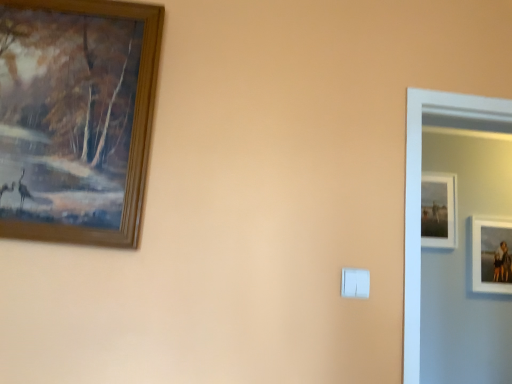
Question: Is wooden picture frame at upper left, acting as the 3th picture frame starting from the right, to the left of white matte picture frame at right, the second picture frame positioned from the back, from the viewer's perspective?

Choices:
 (A) no
 (B) yes

Answer: (B)

Question: Is wooden picture frame at upper left, the first picture frame positioned from the left, oriented away from white matte picture frame at right, the 2th picture frame when ordered from front to back?

Choices:
 (A) no
 (B) yes

Answer: (A)

Question: Does wooden picture frame at upper left, the first picture frame positioned from the left, have a lesser height compared to white matte picture frame at right, the 2th picture frame when ordered from front to back?

Choices:
 (A) yes
 (B) no

Answer: (B)

Question: Does wooden picture frame at upper left, which is counted as the 3th picture frame, starting from the back, have a smaller size compared to white matte picture frame at right, the second picture frame positioned from the back?

Choices:
 (A) no
 (B) yes

Answer: (A)

Question: Is wooden picture frame at upper left, which appears as the first picture frame when viewed from the front, closer to the viewer compared to white matte picture frame at right, placed as the first picture frame when sorted from right to left?

Choices:
 (A) yes
 (B) no

Answer: (A)

Question: Is wooden picture frame at upper left, which is counted as the 3th picture frame, starting from the back, at the right side of white matte picture frame at right, the second picture frame positioned from the back?

Choices:
 (A) no
 (B) yes

Answer: (A)

Question: Considering the relative sizes of matte white picture frame at upper right, acting as the second picture frame starting from the left, and wooden picture frame at upper left, acting as the 3th picture frame starting from the right, in the image provided, is matte white picture frame at upper right, acting as the second picture frame starting from the left, bigger than wooden picture frame at upper left, acting as the 3th picture frame starting from the right,?

Choices:
 (A) no
 (B) yes

Answer: (A)

Question: Does matte white picture frame at upper right, acting as the second picture frame starting from the left, come in front of wooden picture frame at upper left, acting as the 3th picture frame starting from the right?

Choices:
 (A) yes
 (B) no

Answer: (B)

Question: Does matte white picture frame at upper right, the third picture frame when ordered from front to back, have a lesser width compared to wooden picture frame at upper left, the first picture frame positioned from the left?

Choices:
 (A) yes
 (B) no

Answer: (A)

Question: Can you confirm if matte white picture frame at upper right, the third picture frame when ordered from front to back, is wider than wooden picture frame at upper left, which appears as the first picture frame when viewed from the front?

Choices:
 (A) yes
 (B) no

Answer: (B)

Question: Does matte white picture frame at upper right, acting as the second picture frame starting from the left, have a greater height compared to wooden picture frame at upper left, the first picture frame positioned from the left?

Choices:
 (A) no
 (B) yes

Answer: (A)

Question: From the image's perspective, is matte white picture frame at upper right, arranged as the 2th picture frame when viewed from the right, under wooden picture frame at upper left, the first picture frame positioned from the left?

Choices:
 (A) yes
 (B) no

Answer: (A)

Question: From the image's perspective, does matte white picture frame at upper right, which appears as the 1th picture frame when viewed from the back, appear lower than white plastic light switch at center?

Choices:
 (A) no
 (B) yes

Answer: (A)